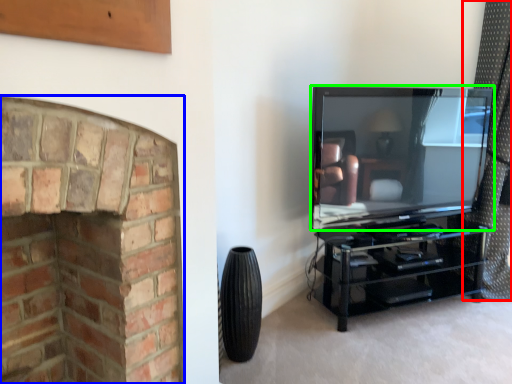
Question: Estimate the real-world distances between objects in this image. Which object is farther from curtain (highlighted by a red box), fireplace (highlighted by a blue box) or television (highlighted by a green box)?

Choices:
 (A) fireplace
 (B) television

Answer: (A)